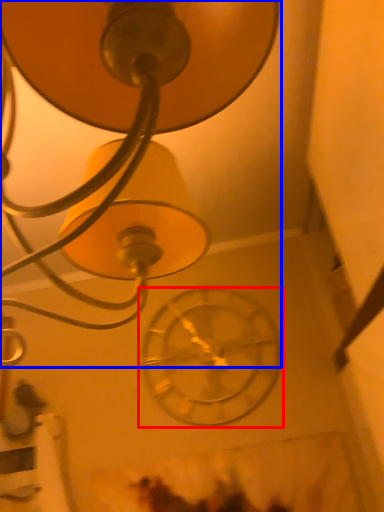
Question: Which point is closer to the camera, wall clock (highlighted by a red box) or lamp (highlighted by a blue box)?

Choices:
 (A) wall clock
 (B) lamp

Answer: (B)